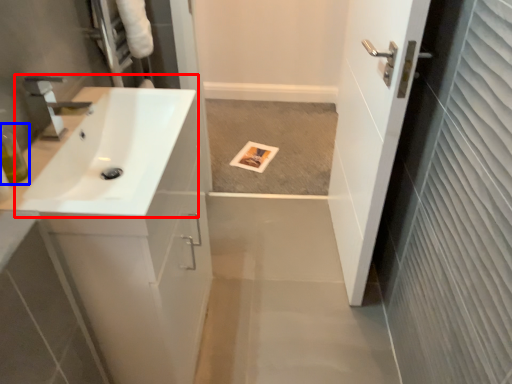
Question: Which point is closer to the camera, sink (highlighted by a red box) or toiletry (highlighted by a blue box)?

Choices:
 (A) sink
 (B) toiletry

Answer: (A)